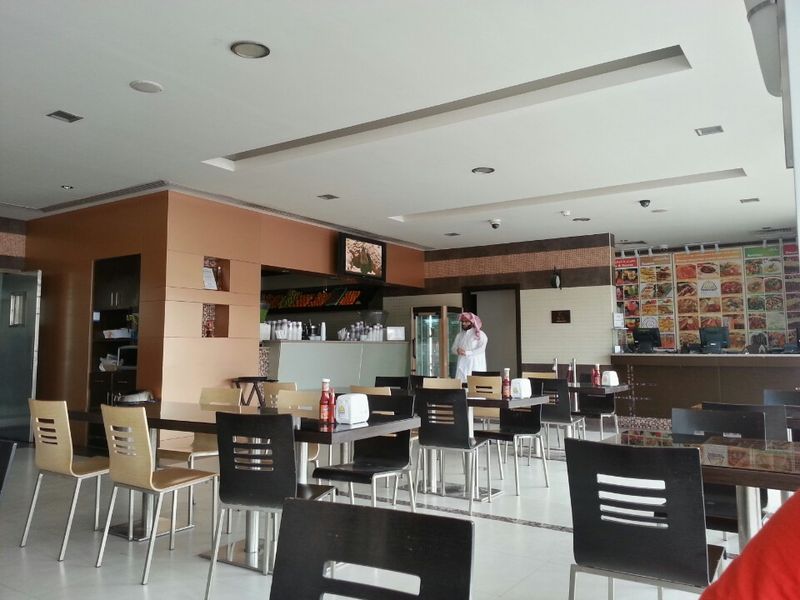
Identify the location of food menu. The image size is (800, 600). (638, 269), (766, 267), (774, 301), (653, 304).